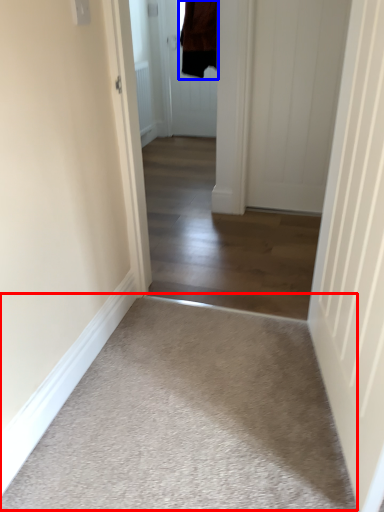
Question: Which of the following is the farthest to the observer, plain (highlighted by a red box) or jacket (highlighted by a blue box)?

Choices:
 (A) plain
 (B) jacket

Answer: (B)